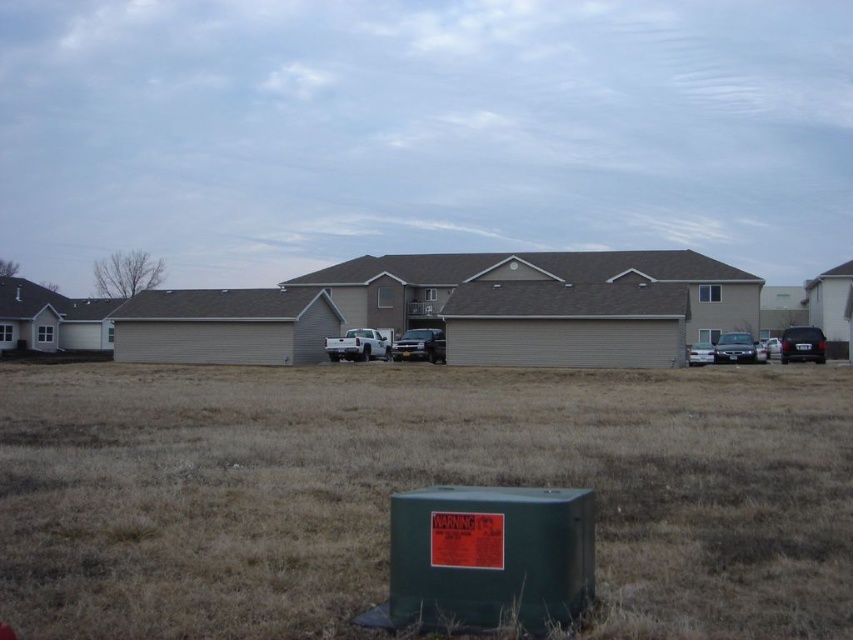
Question: Which of the following is the farthest from the observer?

Choices:
 (A) shiny black sedan at right
 (B) brown dry grass at lower center
 (C) metallic silver truck at center

Answer: (C)

Question: Is brown dry grass at lower center to the right of shiny black sedan at right from the viewer's perspective?

Choices:
 (A) no
 (B) yes

Answer: (A)

Question: Can you confirm if shiny black sedan at right is positioned to the left of satin silver sedan at center?

Choices:
 (A) no
 (B) yes

Answer: (A)

Question: Estimate the real-world distances between objects in this image. Which object is farther from the white glossy sedan at center?

Choices:
 (A) satin black sedan at right
 (B) brown dry grass at lower center
 (C) satin silver sedan at center
 (D) white matte truck at center

Answer: (B)

Question: Is satin silver sedan at center above satin black sedan at right?

Choices:
 (A) yes
 (B) no

Answer: (A)

Question: Which point appears closest to the camera in this image?

Choices:
 (A) (61, 611)
 (B) (775, 355)

Answer: (A)